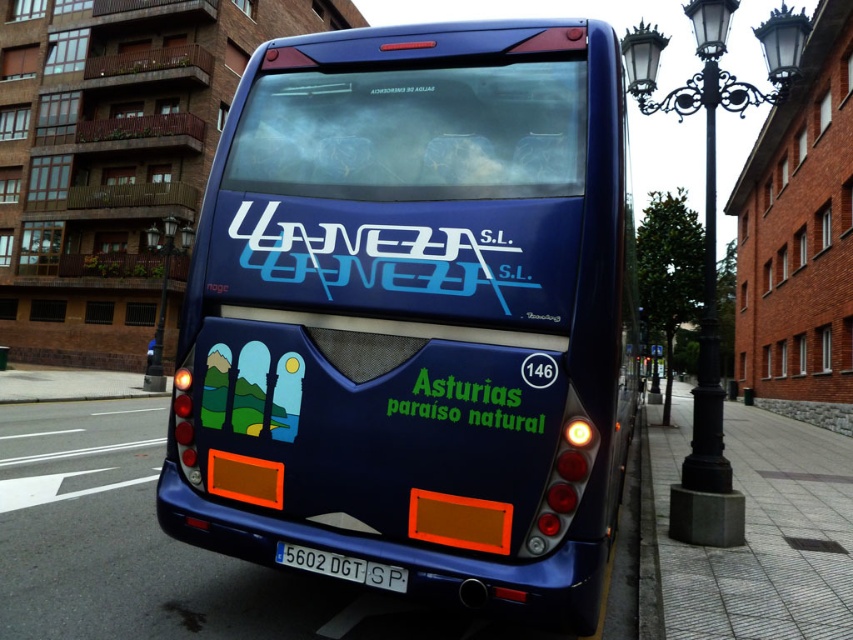
You are standing in front of the blue bus with the rear view shown. You notice two points marked on the bus. Which point is closer to you, point (276, 52) or point (647, 92)?

Point (276, 52) is closer to the viewer than point (647, 92).

You are a delivery person who needs to attach a package to the rear of the blue bus. The package requires a minimum of 80 centimeters of space to be safely secured. Given the distance between the green matte text at center and the blue plastic license plate at lower center, do you think there is enough space for the package?

The distance between the green matte text at center and the blue plastic license plate at lower center is 78.22 centimeters. Since the required space is 80 centimeters, there is insufficient space to safely secure the package.